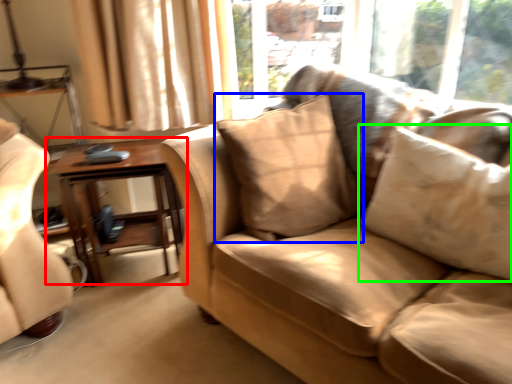
Question: Considering the real-world distances, which object is farthest from table (highlighted by a red box)? pillow (highlighted by a blue box) or pillow (highlighted by a green box)?

Choices:
 (A) pillow
 (B) pillow

Answer: (B)